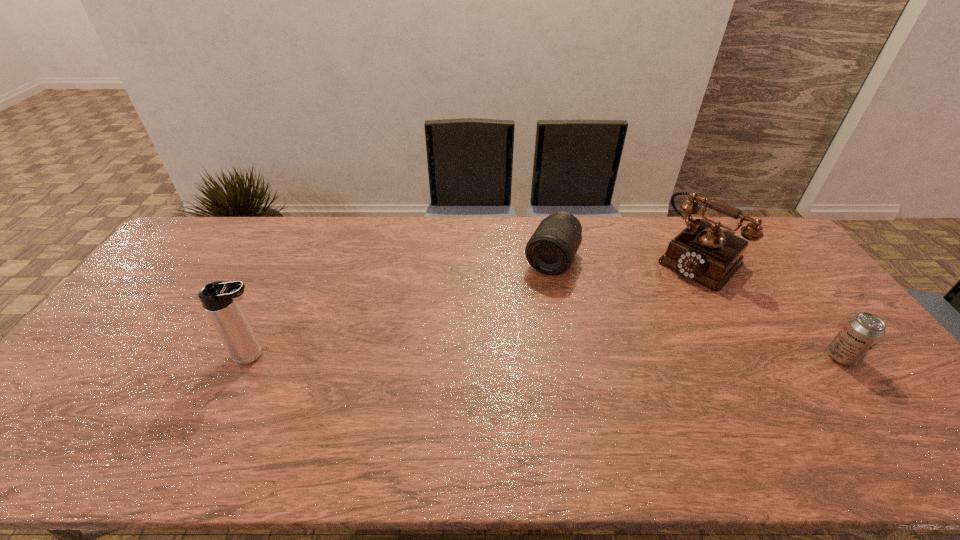
Locate an element on the screen. thermos bottle is located at coordinates (219, 299).

At what (x,y) coordinates should I click in order to perform the action: click on beer can. Please return your answer as a coordinate pair (x, y). The height and width of the screenshot is (540, 960). Looking at the image, I should click on (862, 332).

At what (x,y) coordinates should I click in order to perform the action: click on the third object from left to right. Please return your answer as a coordinate pair (x, y). Image resolution: width=960 pixels, height=540 pixels. Looking at the image, I should click on (710, 256).

You are a GUI agent. You are given a task and a screenshot of the screen. Output one action in this format:
    pyautogui.click(x=<x>, y=<y>)
    Task: Click on the second object from left to right
    The width and height of the screenshot is (960, 540).
    Given the screenshot: What is the action you would take?
    pyautogui.click(x=551, y=250)

At what (x,y) coordinates should I click in order to perform the action: click on vacant area situated on the handle side of the thermos bottle. Please return your answer as a coordinate pair (x, y). The height and width of the screenshot is (540, 960). Looking at the image, I should click on (403, 355).

Locate an element on the screen. blank space located on the left of the beer can is located at coordinates (719, 357).

The height and width of the screenshot is (540, 960). I want to click on free space located on the dial of the second object from right to left, so click(668, 292).

Identify the location of vacant region located on the dial of the second object from right to left. (629, 329).

The height and width of the screenshot is (540, 960). What are the coordinates of `blank area located 0.140m on the dial of the second object from right to left` in the screenshot? It's located at (657, 303).

The height and width of the screenshot is (540, 960). Find the location of `blank space located on the surface of the second object from left to right`. blank space located on the surface of the second object from left to right is located at coordinates (512, 340).